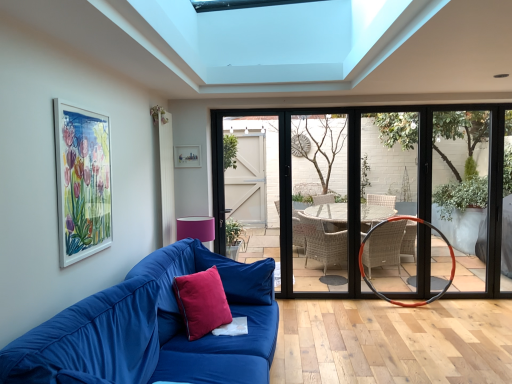
Question: Is matte wooden picture frame at upper center, which is counted as the 1th picture frame, starting from the back, inside the boundaries of satin red pillow at center, acting as the second pillow starting from the back, or outside?

Choices:
 (A) outside
 (B) inside

Answer: (A)

Question: Is matte wooden picture frame at upper center, which ranks as the second picture frame in left-to-right order, in front of or behind satin red pillow at center, acting as the second pillow starting from the back, in the image?

Choices:
 (A) behind
 (B) front

Answer: (A)

Question: Which is farther from the velvet red pillow at lower left, which ranks as the 2th pillow in front-to-back order?

Choices:
 (A) velvet blue couch at lower left
 (B) matte black door at center
 (C) orange rubber basketball hoop at right
 (D) matte wooden picture frame at upper center, which appears as the 1th picture frame when viewed from the right
 (E) white glossy picture frame at upper left, which is the 2th picture frame in right-to-left order

Answer: (B)

Question: Considering the real-world distances, which object is farthest from the matte black door at center?

Choices:
 (A) white glossy picture frame at upper left, which is the 2th picture frame in right-to-left order
 (B) matte wooden picture frame at upper center, which ranks as the second picture frame in left-to-right order
 (C) satin red pillow at center, acting as the first pillow starting from the front
 (D) velvet red pillow at lower left, which ranks as the 2th pillow in front-to-back order
 (E) orange rubber basketball hoop at right

Answer: (A)